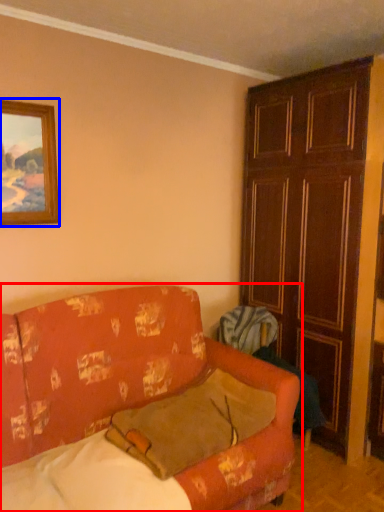
Question: Which point is further to the camera, studio couch (highlighted by a red box) or picture frame (highlighted by a blue box)?

Choices:
 (A) studio couch
 (B) picture frame

Answer: (B)